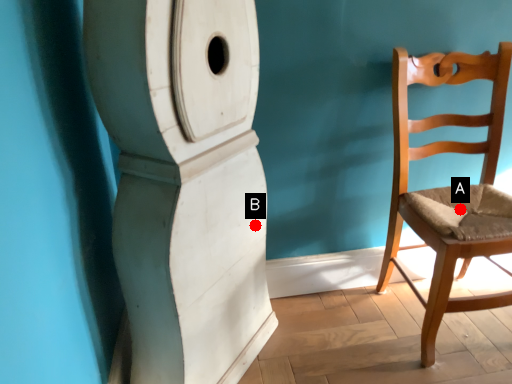
Question: Two points are circled on the image, labeled by A and B beside each circle. Which point is closer to the camera?

Choices:
 (A) A is closer
 (B) B is closer

Answer: (B)